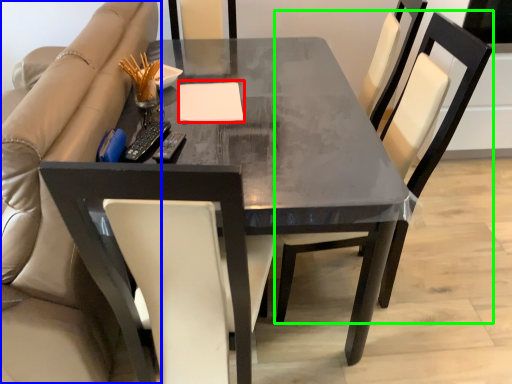
Question: Estimate the real-world distances between objects in this image. Which object is farther from notepad (highlighted by a red box), beige (highlighted by a blue box) or chair (highlighted by a green box)?

Choices:
 (A) beige
 (B) chair

Answer: (B)